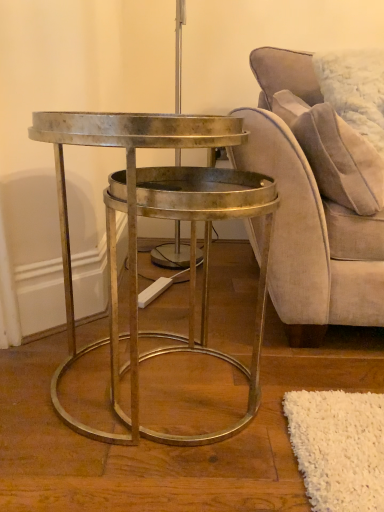
Question: Considering their positions, is suede beige chair at right located in front of or behind metallic gold table at center?

Choices:
 (A) behind
 (B) front

Answer: (A)

Question: Looking at the image, does suede beige chair at right seem bigger or smaller compared to metallic gold table at center?

Choices:
 (A) big
 (B) small

Answer: (A)

Question: Which is nearer to the suede beige chair at right?

Choices:
 (A) suede-like beige pillow at upper right
 (B) metallic gold table at center

Answer: (A)

Question: Considering the real-world distances, which object is closest to the suede-like beige pillow at upper right?

Choices:
 (A) suede beige chair at right
 (B) metallic gold table at center

Answer: (A)